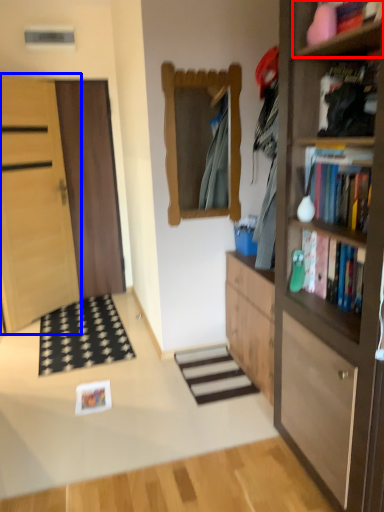
Question: Among these objects, which one is nearest to the camera, cabinet (highlighted by a red box) or door (highlighted by a blue box)?

Choices:
 (A) cabinet
 (B) door

Answer: (A)